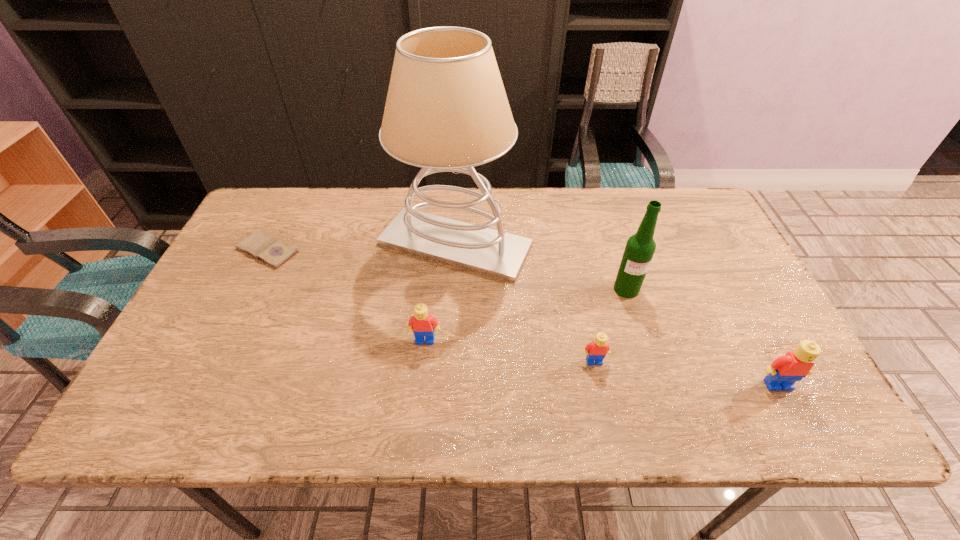
Image resolution: width=960 pixels, height=540 pixels. Find the location of `object that is at the near right corner`. object that is at the near right corner is located at coordinates (784, 371).

Identify the location of free region at the far edge. Image resolution: width=960 pixels, height=540 pixels. (381, 215).

Image resolution: width=960 pixels, height=540 pixels. What are the coordinates of `blank area at the near edge` in the screenshot? It's located at (285, 363).

Locate an element on the screen. This screenshot has width=960, height=540. blank area at the right edge is located at coordinates (702, 294).

The width and height of the screenshot is (960, 540). In the image, there is a desktop. Identify the location of free space at the near left corner. (185, 357).

Identify the location of free space at the far right corner of the desktop. This screenshot has height=540, width=960. (684, 233).

Locate an element on the screen. empty space that is in between the diary and the table lamp is located at coordinates (361, 247).

The width and height of the screenshot is (960, 540). What are the coordinates of `unoccupied position between the table lamp and the third tallest object` in the screenshot? It's located at tap(616, 315).

Find the location of a particular element. The width and height of the screenshot is (960, 540). vacant space that is in between the rightmost Lego and the tallest object is located at coordinates (616, 315).

At what (x,y) coordinates should I click in order to perform the action: click on free space between the shortest Lego and the third tallest object. Please return your answer as a coordinate pair (x, y). This screenshot has height=540, width=960. Looking at the image, I should click on (685, 373).